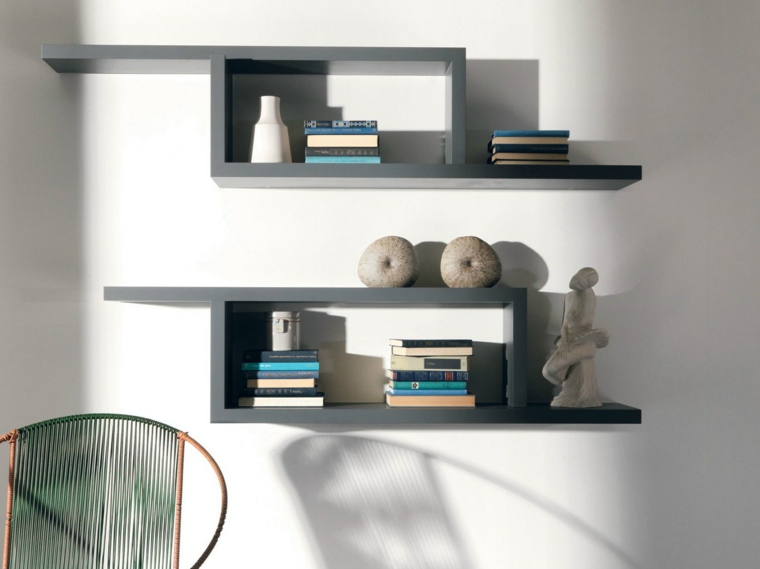
At what (x,y) coordinates should I click in order to perform the action: click on shelf edge. Please return your answer as a coordinate pair (x, y). The height and width of the screenshot is (569, 760). Looking at the image, I should click on (580, 417), (138, 292), (616, 172), (83, 53).